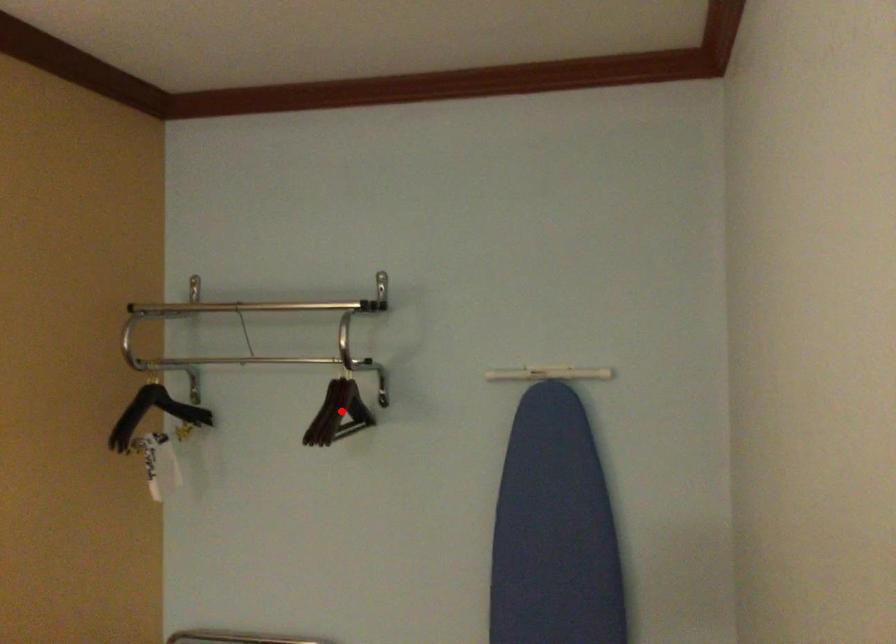
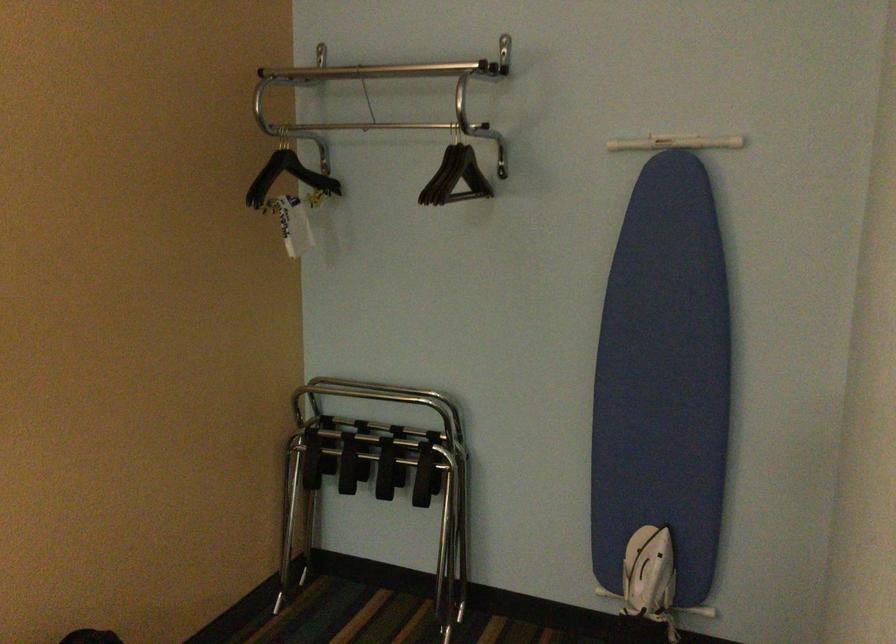
Find the pixel in the second image that matches the highlighted location in the first image.

(455, 176)